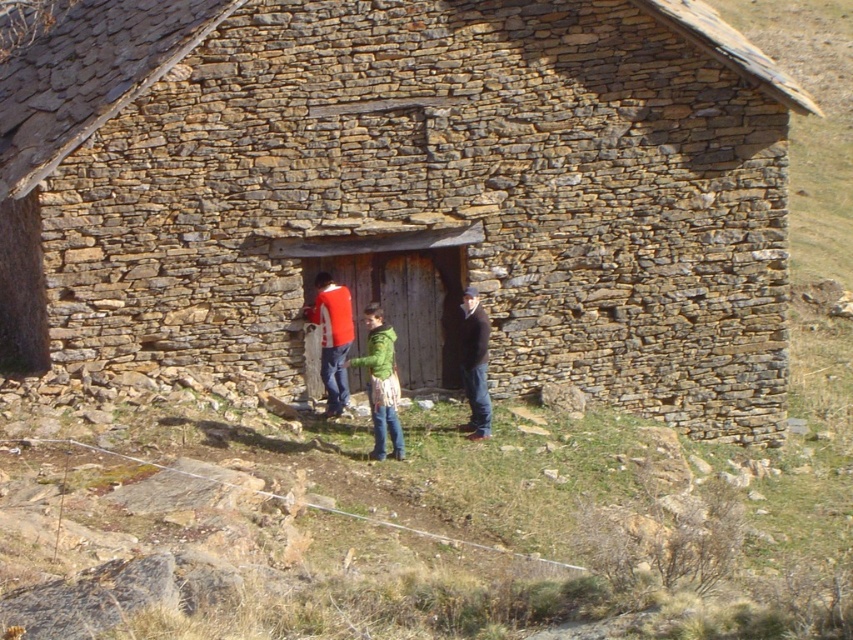
Consider the image. You are standing outside the rustic stone hut at center and want to enter through the wooden door. There is a dark brown leather jacket at center blocking the doorway. Can you walk straight into the door without moving the jacket?

The rustic stone hut at center is in front of the dark brown leather jacket at center, meaning the jacket is behind the door. Therefore, you can walk straight into the door without needing to move the jacket.

You are standing in front of the rustic stone hut at center and want to greet the person wearing the red cotton sweater at center. Which direction should you move to approach them?

You should move to your left because the rustic stone hut at center is to the right of the red cotton sweater at center, meaning the sweater is to your left relative to the hut.